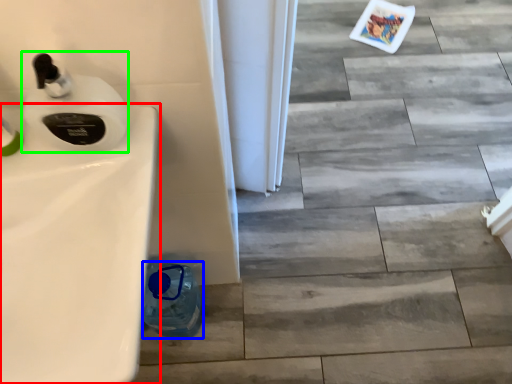
Question: Considering the real-world distances, which object is closest to sink (highlighted by a red box)? bottle (highlighted by a blue box) or soap dispenser (highlighted by a green box).

Choices:
 (A) bottle
 (B) soap dispenser

Answer: (B)